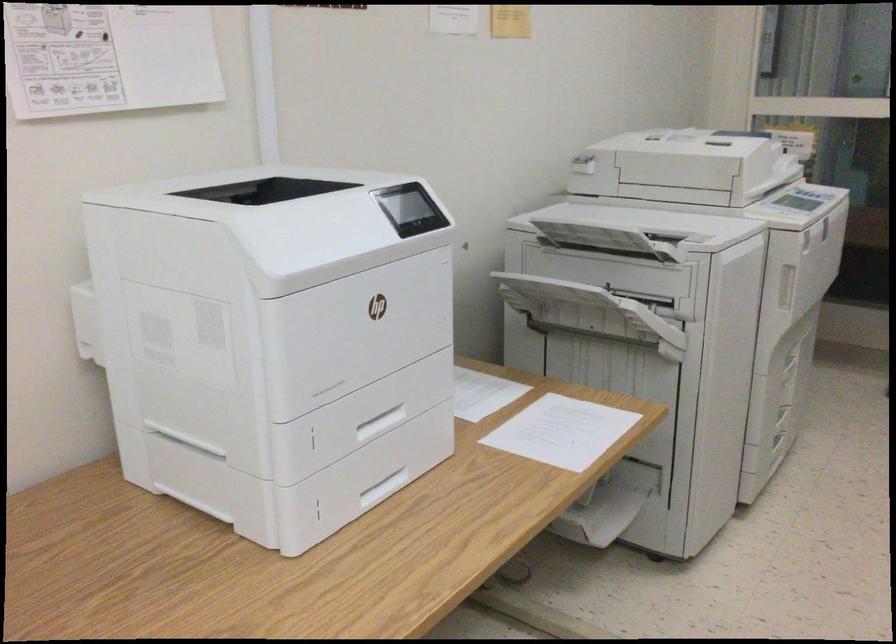
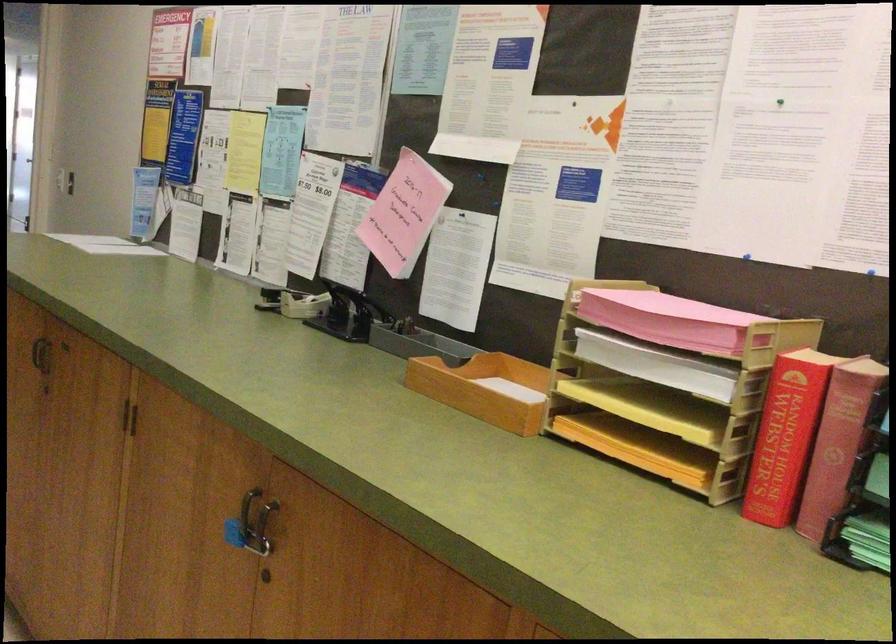
Question: The first image is from the beginning of the video and the second image is from the end. How did the camera likely rotate when shooting the video?

Choices:
 (A) Left
 (B) Right
 (C) Up
 (D) Down

Answer: (B)